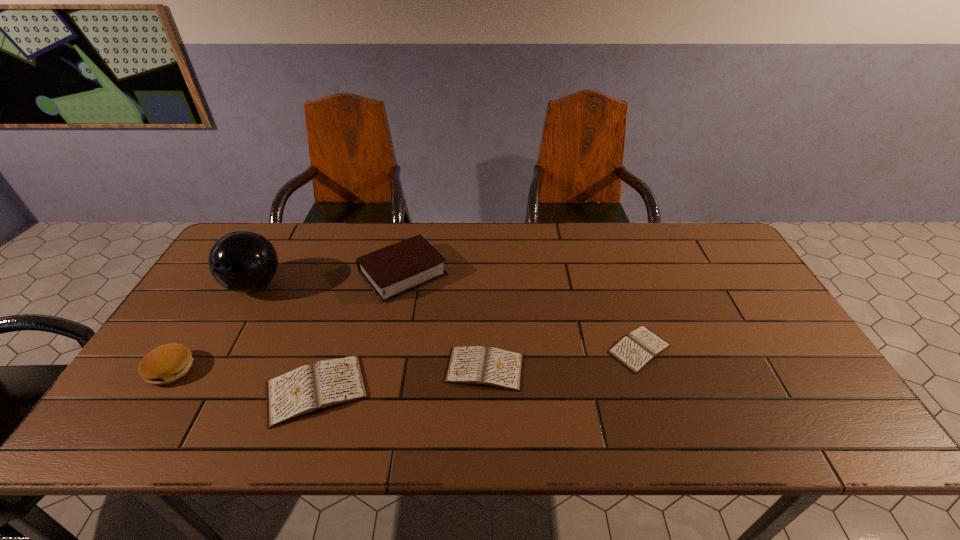
The width and height of the screenshot is (960, 540). What are the coordinates of `the fourth tallest object` in the screenshot? It's located at (309, 389).

Locate an element on the screen. the tallest diary is located at coordinates (309, 389).

You are a GUI agent. You are given a task and a screenshot of the screen. Output one action in this format:
    pyautogui.click(x=<x>, y=<y>)
    Task: Click on the second shortest object
    This screenshot has width=960, height=540.
    Given the screenshot: What is the action you would take?
    pyautogui.click(x=476, y=365)

Where is `the second shortest diary`? This screenshot has width=960, height=540. the second shortest diary is located at coordinates (476, 365).

Where is `the rightmost diary`? the rightmost diary is located at coordinates (641, 346).

Find the location of a particular element. The height and width of the screenshot is (540, 960). the rightmost object is located at coordinates (641, 346).

Image resolution: width=960 pixels, height=540 pixels. Find the location of `Bible`. Bible is located at coordinates (391, 271).

Find the location of `the tallest object`. the tallest object is located at coordinates (242, 261).

The image size is (960, 540). In order to click on patty in this screenshot , I will do `click(165, 364)`.

In order to click on vacant space located 0.190m on the left of the fourth tallest object in this screenshot , I will do `click(184, 390)`.